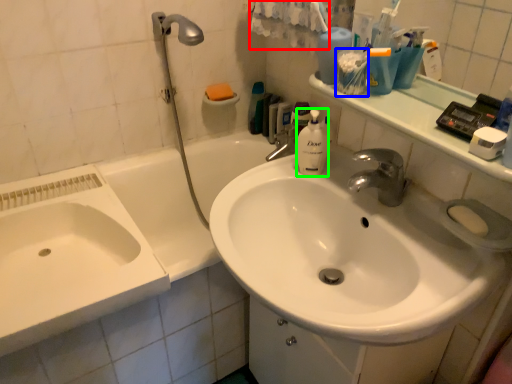
Question: Which object is the farthest from bath towel (highlighted by a red box)? Choose among these: mouthwash (highlighted by a blue box) or cleaning product (highlighted by a green box).

Choices:
 (A) mouthwash
 (B) cleaning product

Answer: (A)